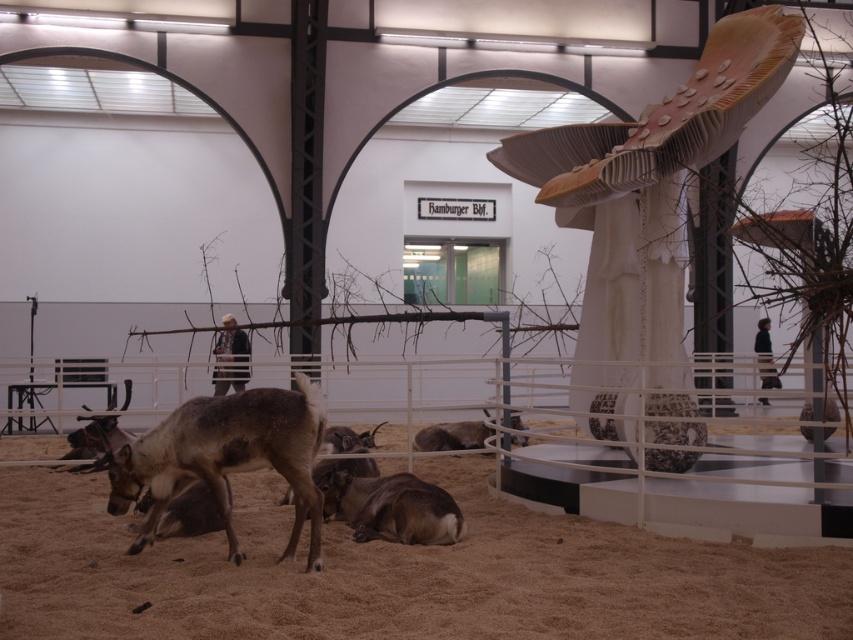
You are an artist planning to place a new sculpture on the brown sandy ground at lower center. However, there is already a brown fur deer at center in the scene. Based on their positions, where exactly should you place the new sculpture to ensure it doesn not overlap with the existing deer?

The brown sandy ground at lower center is positioned under brown fur deer at center, so you should place the new sculpture on the brown sandy ground at lower center but away from the area directly under the brown fur deer at center to avoid overlapping.

You are an art curator planning to install a new light fixture in the gallery. The light needs to be placed directly above the wooden sculpture at center. According to the gallery layout, the ceiling grid coordinates are measured from the bottom left corner. Can you determine the exact coordinates where the light should be installed?

The wooden sculpture at center is located at point (648, 205), so the light fixture should be installed at the same coordinates on the ceiling grid to be directly above it.

You are an artist planning to place a new sculpture in the gallery. You notice the brown sandy ground at lower center and the wooden sculpture at center. Which area has more space available for placing additional items?

The wooden sculpture at center has more space available because the brown sandy ground at lower center is smaller in size compared to it.